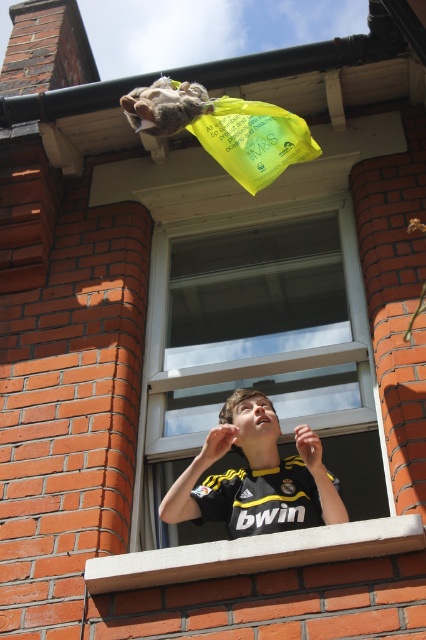
You are a window cleaner needing to reach both the black jersey at center and the fuzzy fur at upper center. Which object is wider so you can prioritize cleaning it first?

The black jersey at center might be wider than fuzzy fur at upper center, so you should prioritize cleaning the black jersey at center first.

You are a photographer trying to capture a clear shot of the black jersey at center and the fuzzy fur at upper center. Since you can only focus on one object at a time, which one should you focus on first to ensure it appears sharp in the photo?

The black jersey at center is closer to the viewer than the fuzzy fur at upper center, so you should focus on the black jersey at center first to ensure it appears sharp. When focusing on the closer object, the farther object may still be in acceptable focus depending on the lens and aperture used, but prioritizing the closer subject ensures clarity.